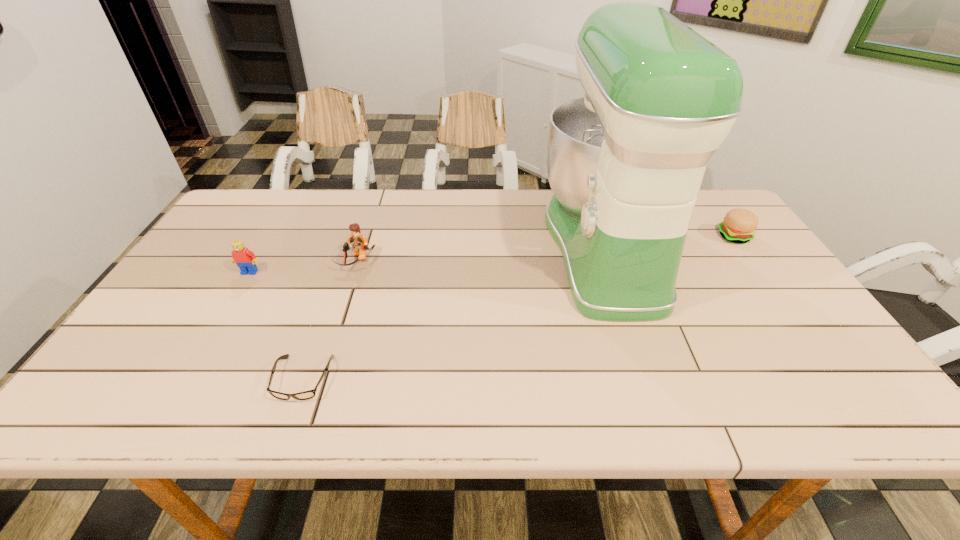
Find the location of `free space at the far edge of the desktop`. free space at the far edge of the desktop is located at coordinates (365, 210).

The image size is (960, 540). In the image, there is a desktop. Identify the location of free space at the near edge. (300, 408).

Locate an element on the screen. vacant space at the left edge is located at coordinates (180, 371).

Find the location of `free space at the far left corner`. free space at the far left corner is located at coordinates (277, 195).

Image resolution: width=960 pixels, height=540 pixels. Find the location of `blank space at the far right corner`. blank space at the far right corner is located at coordinates (701, 212).

Locate an element on the screen. This screenshot has width=960, height=540. free space that is in between the nearest object and the left Lego is located at coordinates (276, 325).

Locate an element on the screen. blank region between the nearest object and the right Lego is located at coordinates (329, 321).

Locate an element on the screen. This screenshot has height=540, width=960. free space between the shortest object and the right Lego is located at coordinates (329, 321).

Where is `free space between the right Lego and the shortest object`? The height and width of the screenshot is (540, 960). free space between the right Lego and the shortest object is located at coordinates (329, 321).

Image resolution: width=960 pixels, height=540 pixels. What are the coordinates of `vacant space in between the mixer and the nearest object` in the screenshot? It's located at (453, 313).